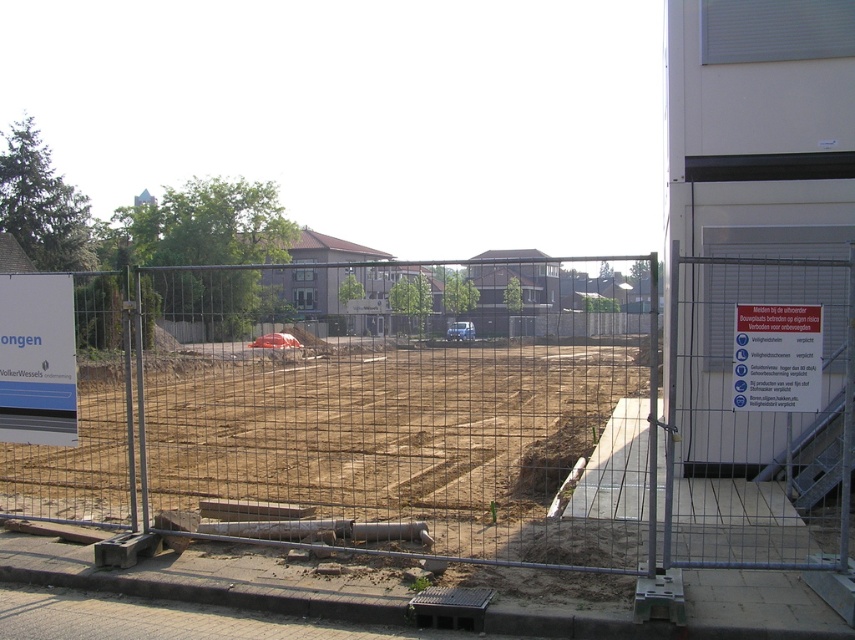
Question: Which point appears farthest from the camera in this image?

Choices:
 (A) (634, 568)
 (B) (31, 337)

Answer: (B)

Question: Is brown dirt at center above white paper sign at left?

Choices:
 (A) no
 (B) yes

Answer: (B)

Question: Which point appears closest to the camera in this image?

Choices:
 (A) (360, 474)
 (B) (24, 337)
 (C) (805, 371)

Answer: (C)

Question: Is white paper sign at left bigger than blue plastic sign at upper center?

Choices:
 (A) yes
 (B) no

Answer: (A)

Question: Can you confirm if brown dirt at center is positioned below white paper sign at right?

Choices:
 (A) yes
 (B) no

Answer: (B)

Question: Which of the following is the farthest from the observer?

Choices:
 (A) white paper sign at right
 (B) white paper sign at left

Answer: (B)